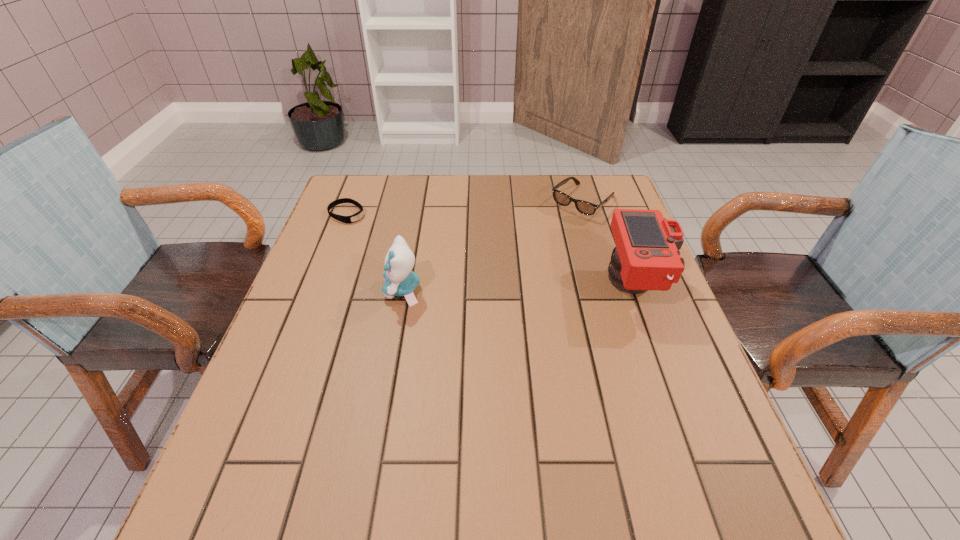
This screenshot has width=960, height=540. I want to click on free spot on the desktop that is between the kitten and the camera and is positioned on the lenses of the spectacles, so click(x=490, y=289).

Identify the location of free space on the desktop that is between the kitten and the camera and is positioned on the display of the leftmost object. (488, 289).